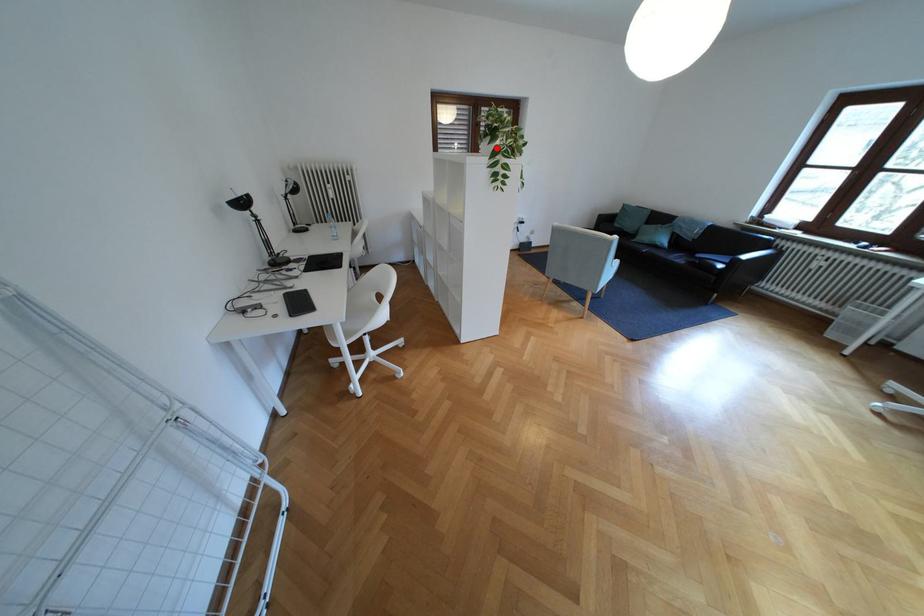
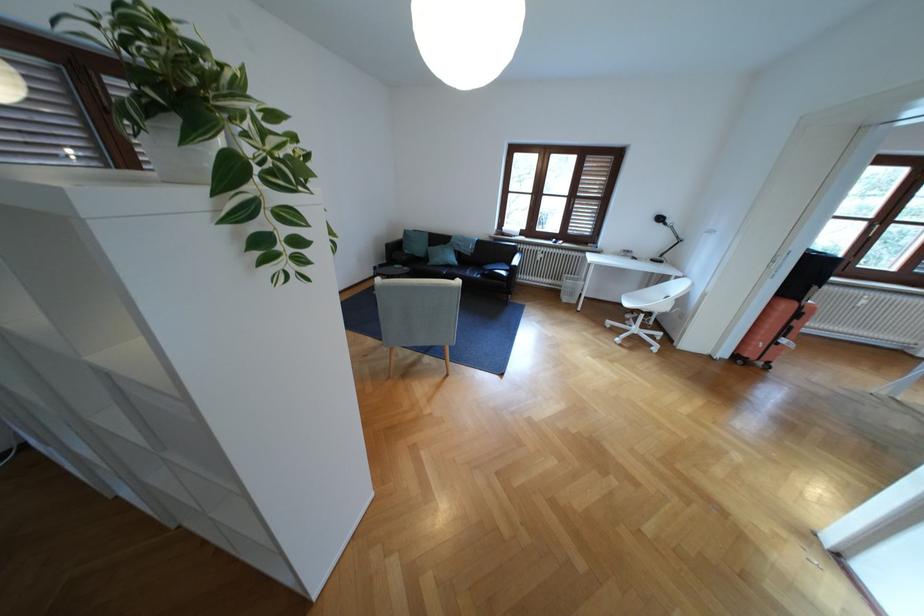
Find the pixel in the second image that matches the highlighted location in the first image.

(187, 155)